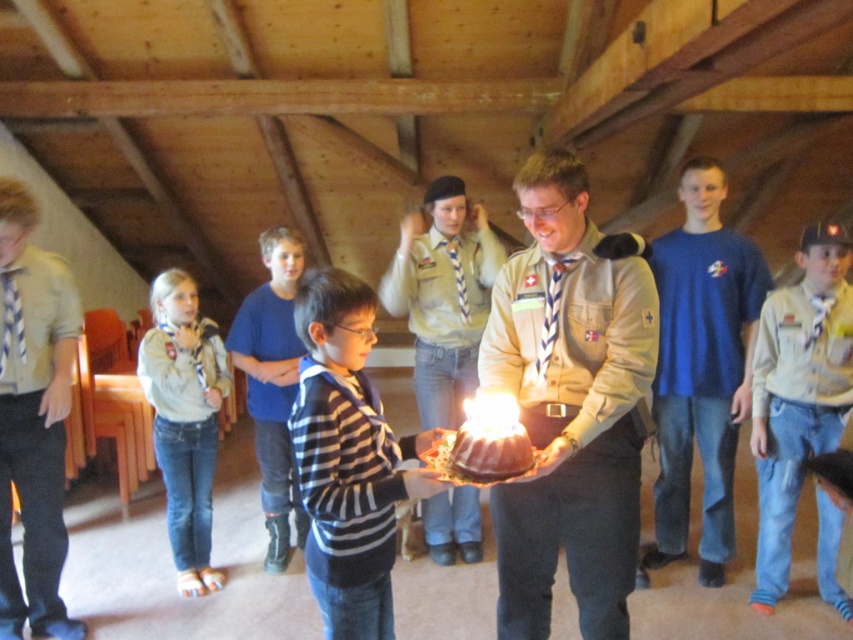
Can you confirm if black striped sweater at center is bigger than striped cotton shirt at center?

Actually, black striped sweater at center might be smaller than striped cotton shirt at center.

Is the position of black striped sweater at center more distant than that of striped cotton shirt at center?

No.

What do you see at coordinates (347, 458) in the screenshot?
I see `black striped sweater at center` at bounding box center [347, 458].

I want to click on black striped sweater at center, so (x=347, y=458).

Is light brown uniform at center below striped cotton shirt at center?

Yes, light brown uniform at center is below striped cotton shirt at center.

Does point (42, 634) come behind point (469, 353)?

No, (42, 634) is closer to viewer.

Describe the element at coordinates (33, 417) in the screenshot. Image resolution: width=853 pixels, height=640 pixels. I see `light brown uniform at center` at that location.

Locate an element on the screen. This screenshot has width=853, height=640. light brown uniform at center is located at coordinates (33, 417).

Can you confirm if matte khaki uniform at center is wider than light brown uniform at center?

Indeed, matte khaki uniform at center has a greater width compared to light brown uniform at center.

Measure the distance between point (607, 440) and camera.

Point (607, 440) and camera are 2.04 meters apart.

Who is more distant from viewer, (590, 310) or (9, 525)?

Point (9, 525)

Where is `matte khaki uniform at center`? The image size is (853, 640). matte khaki uniform at center is located at coordinates (570, 404).